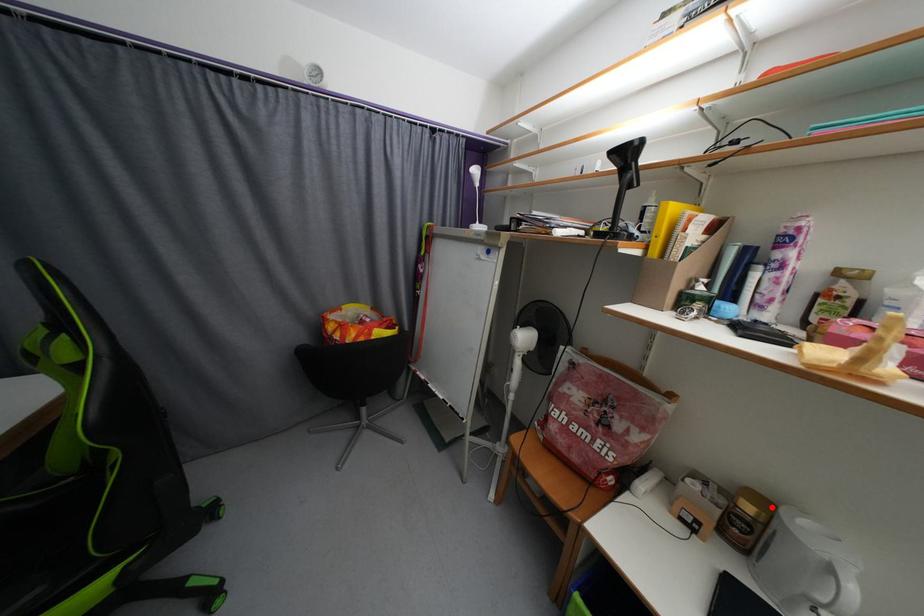
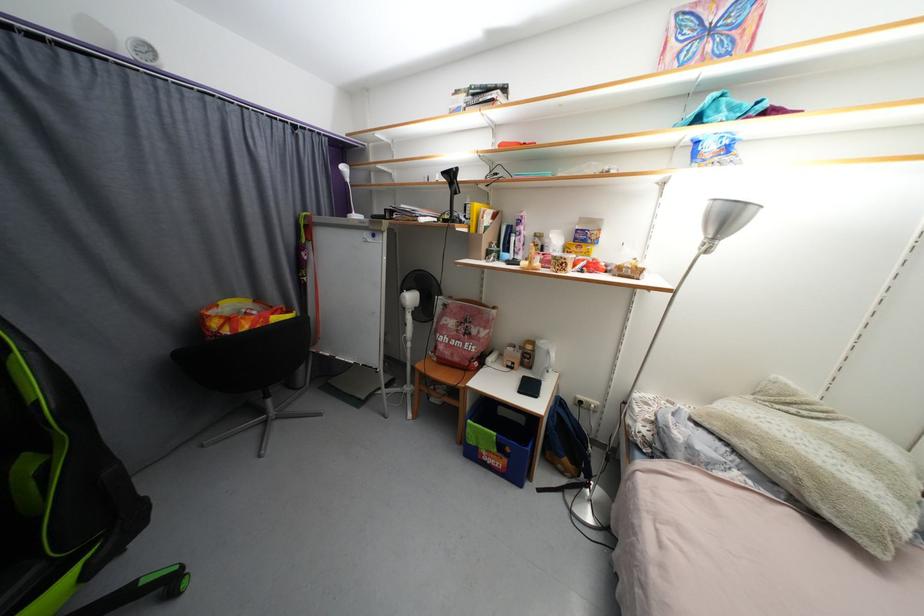
Question: A red point is marked in image1. In image2, is the corresponding 3D point closer to the camera or farther? Reply with the corresponding letter.

Choices:
 (A) The corresponding 3D point is closer.
 (B) The corresponding 3D point is farther.

Answer: (A)